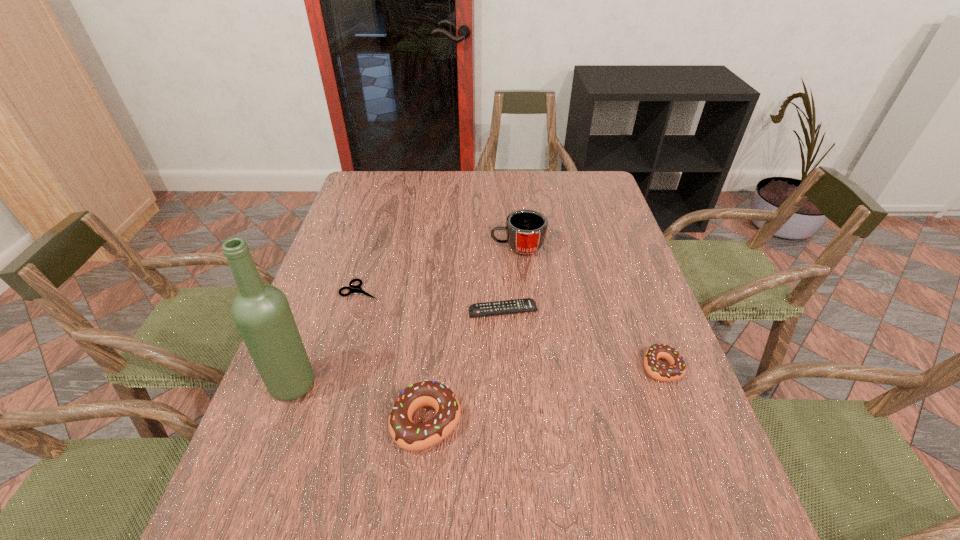
Find the location of `object that ranks as the third closest to the second farthest object`. object that ranks as the third closest to the second farthest object is located at coordinates (408, 435).

Identify the location of free space that satisfies the following two spatial constraints: 1. on the back side of the taller doughnut; 2. on the left side of the rightmost object. (432, 367).

Identify the location of free region that satisfies the following two spatial constraints: 1. on the back side of the left doughnut; 2. on the left side of the fourth tallest object. This screenshot has width=960, height=540. (432, 367).

You are a GUI agent. You are given a task and a screenshot of the screen. Output one action in this format:
    pyautogui.click(x=<x>, y=<y>)
    Task: Click on the free location that satisfies the following two spatial constraints: 1. on the front side of the remote control; 2. on the right side of the shears
    This screenshot has height=540, width=960.
    Given the screenshot: What is the action you would take?
    pyautogui.click(x=354, y=311)